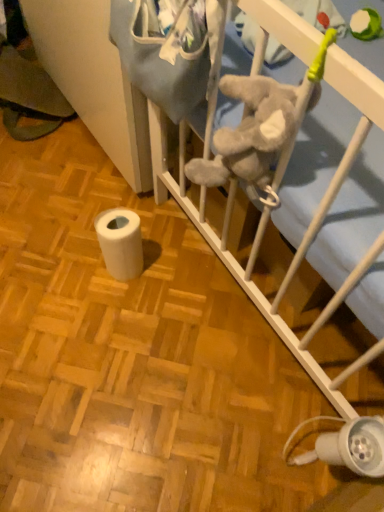
Question: Does white plastic lamp at lower right have a greater height compared to white matte toilet paper at lower left?

Choices:
 (A) no
 (B) yes

Answer: (A)

Question: From a real-world perspective, is white plastic lamp at lower right beneath white matte toilet paper at lower left?

Choices:
 (A) yes
 (B) no

Answer: (B)

Question: Are white plastic lamp at lower right and white matte toilet paper at lower left far apart?

Choices:
 (A) yes
 (B) no

Answer: (B)

Question: Can you confirm if white plastic lamp at lower right is shorter than white matte toilet paper at lower left?

Choices:
 (A) yes
 (B) no

Answer: (A)

Question: Considering the relative sizes of white plastic lamp at lower right and white matte toilet paper at lower left in the image provided, is white plastic lamp at lower right smaller than white matte toilet paper at lower left?

Choices:
 (A) yes
 (B) no

Answer: (B)

Question: From the image's perspective, relative to white plastic lamp at lower right, is white soft infant bed at center above or below?

Choices:
 (A) below
 (B) above

Answer: (B)

Question: Considering the positions of point (337, 188) and point (327, 458), is point (337, 188) closer or farther from the camera than point (327, 458)?

Choices:
 (A) closer
 (B) farther

Answer: (A)

Question: Relative to white plastic lamp at lower right, is white soft infant bed at center in front or behind?

Choices:
 (A) front
 (B) behind

Answer: (B)

Question: In the image, is white soft infant bed at center on the left side or the right side of white plastic lamp at lower right?

Choices:
 (A) left
 (B) right

Answer: (A)

Question: From a real-world perspective, is white plastic lamp at lower right above or below white soft infant bed at center?

Choices:
 (A) above
 (B) below

Answer: (A)

Question: Is white plastic lamp at lower right bigger or smaller than white soft infant bed at center?

Choices:
 (A) big
 (B) small

Answer: (B)

Question: Is white plastic lamp at lower right inside the boundaries of white soft infant bed at center, or outside?

Choices:
 (A) inside
 (B) outside

Answer: (B)

Question: From their relative heights in the image, would you say white plastic lamp at lower right is taller or shorter than white soft infant bed at center?

Choices:
 (A) tall
 (B) short

Answer: (A)

Question: Considering the relative positions of white soft infant bed at center and white matte toilet paper at lower left in the image provided, is white soft infant bed at center to the left or to the right of white matte toilet paper at lower left?

Choices:
 (A) left
 (B) right

Answer: (A)

Question: In terms of height, does white soft infant bed at center look taller or shorter compared to white matte toilet paper at lower left?

Choices:
 (A) tall
 (B) short

Answer: (B)